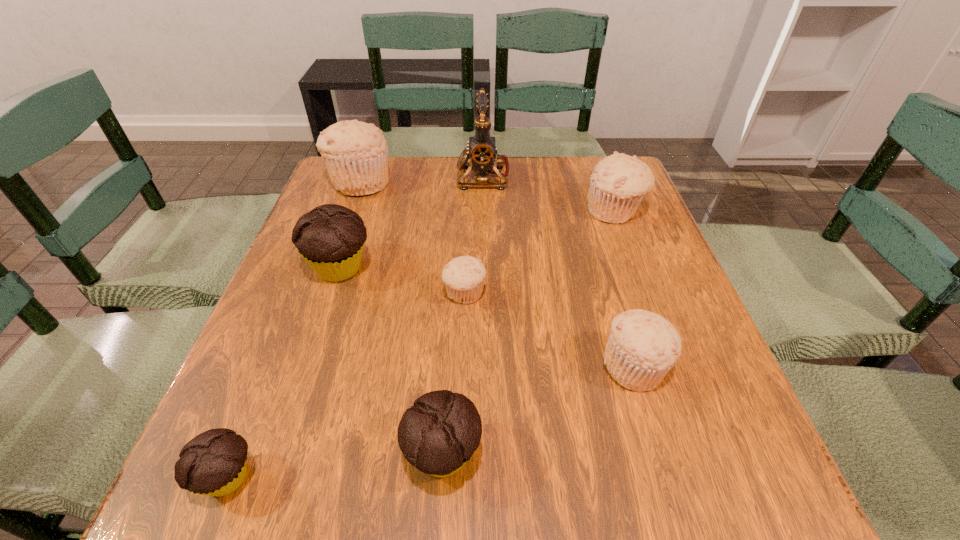
Locate an element on the screen. The image size is (960, 540). telephone is located at coordinates pos(482,152).

This screenshot has width=960, height=540. I want to click on the tallest object, so click(x=482, y=152).

Locate an element on the screen. Image resolution: width=960 pixels, height=540 pixels. the tallest muffin is located at coordinates (356, 154).

At what (x,y) coordinates should I click in order to perform the action: click on the biggest beige muffin. Please return your answer as a coordinate pair (x, y). This screenshot has height=540, width=960. Looking at the image, I should click on (356, 154).

At what (x,y) coordinates should I click in order to perform the action: click on the third smallest beige muffin. Please return your answer as a coordinate pair (x, y). The width and height of the screenshot is (960, 540). Looking at the image, I should click on (619, 182).

This screenshot has width=960, height=540. In order to click on the farthest chocolate muffin in this screenshot , I will do `click(330, 238)`.

You are a GUI agent. You are given a task and a screenshot of the screen. Output one action in this format:
    pyautogui.click(x=<x>, y=<y>)
    Task: Click on the third biggest beige muffin
    The image size is (960, 540).
    Given the screenshot: What is the action you would take?
    pyautogui.click(x=642, y=347)

Image resolution: width=960 pixels, height=540 pixels. What are the coordinates of `the third nearest object` in the screenshot? It's located at (642, 347).

Where is `the rightmost chocolate muffin`? The width and height of the screenshot is (960, 540). the rightmost chocolate muffin is located at coordinates (438, 435).

Find the location of `the third farthest beige muffin`. the third farthest beige muffin is located at coordinates (463, 276).